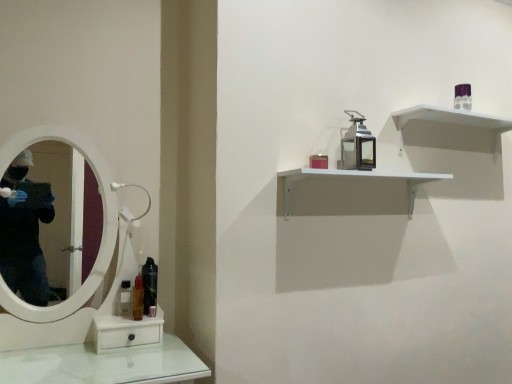
Question: Is black glossy mouthwash at lower left, the first mouthwash viewed from the right, bigger or smaller than purple glossy perfume at upper right, the 2th toiletry positioned from the bottom?

Choices:
 (A) big
 (B) small

Answer: (A)

Question: Considering the positions of black glossy mouthwash at lower left, which appears as the third mouthwash when viewed from the left, and purple glossy perfume at upper right, the 2th toiletry from the front, in the image, is black glossy mouthwash at lower left, which appears as the third mouthwash when viewed from the left, taller or shorter than purple glossy perfume at upper right, the 2th toiletry from the front,?

Choices:
 (A) tall
 (B) short

Answer: (A)

Question: Which object is the closest to the black glossy mouthwash at lower left, which appears as the third mouthwash when viewed from the left?

Choices:
 (A) matte red candle at upper center, marked as the 1th toiletry in a left-to-right arrangement
 (B) clear plastic bottle at lower left, which is the 3th mouthwash in right-to-left order
 (C) purple glossy perfume at upper right, the 1th toiletry in the right-to-left sequence
 (D) translucent plastic mouthwash at left, marked as the 2th mouthwash in a right-to-left arrangement
 (E) white matte shelf at upper right, acting as the 1th shelf starting from the top

Answer: (D)

Question: Which object is the closest to the white matte shelf at upper right, which appears as the second shelf when ordered from the bottom?

Choices:
 (A) clear plastic bottle at lower left, which is the 3th mouthwash in right-to-left order
 (B) purple glossy perfume at upper right, arranged as the 1th toiletry when viewed from the top
 (C) black glossy mouthwash at lower left, which appears as the third mouthwash when viewed from the left
 (D) translucent plastic mouthwash at left, marked as the 2th mouthwash in a right-to-left arrangement
 (E) white matte shelf at upper right, which ranks as the 1th shelf in bottom-to-top order

Answer: (B)